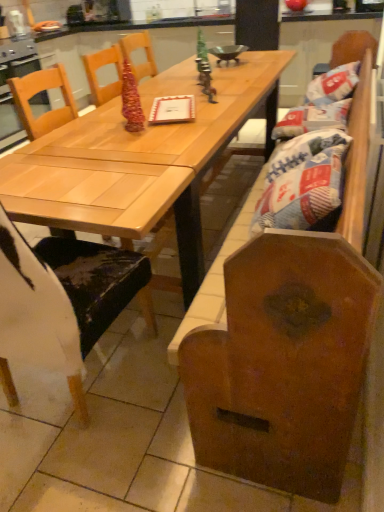
Question: In the image, is light wood table at center positioned in front of or behind white paper bag at right?

Choices:
 (A) behind
 (B) front

Answer: (B)

Question: Is light wood table at center spatially inside white paper bag at right, or outside of it?

Choices:
 (A) inside
 (B) outside

Answer: (B)

Question: Which object is the farthest from the light wood table at center?

Choices:
 (A) wooden chair at left
 (B) white paper bag at right

Answer: (A)

Question: Which object is positioned farthest from the white paper bag at right?

Choices:
 (A) wooden chair at left
 (B) light wood table at center

Answer: (A)